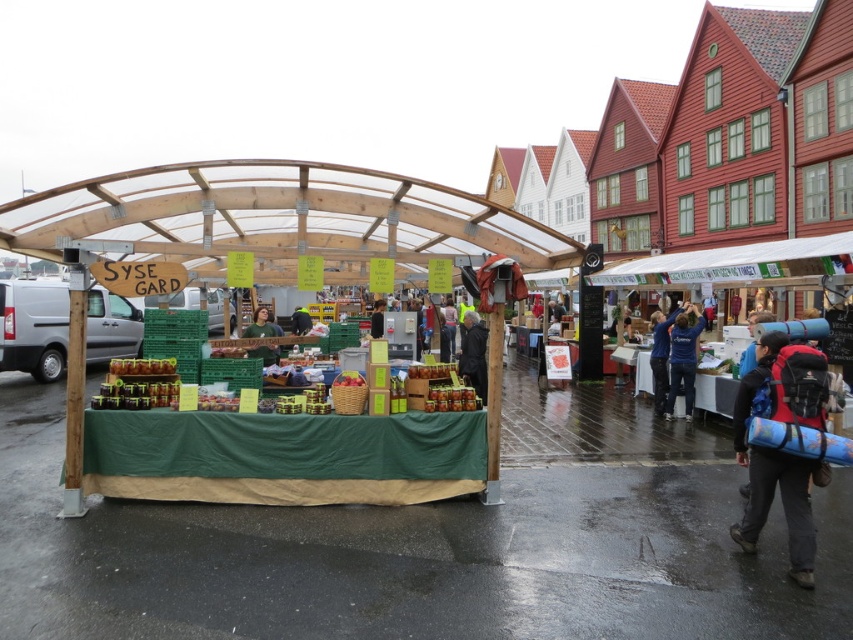
Question: Can you confirm if blue cotton shirt at center is positioned to the right of dark gray jacket at center?

Choices:
 (A) yes
 (B) no

Answer: (A)

Question: Which object is closer to the camera taking this photo?

Choices:
 (A) dark gray jacket at center
 (B) red backpack at right
 (C) blue cotton shirt at center

Answer: (B)

Question: Among these points, which one is farthest from the camera?

Choices:
 (A) (260, 308)
 (B) (802, 556)

Answer: (A)

Question: Can you confirm if red backpack at right is positioned below matte black jacket at center?

Choices:
 (A) yes
 (B) no

Answer: (A)

Question: Which object appears closest to the camera in this image?

Choices:
 (A) matte black jacket at center
 (B) dark gray jacket at center
 (C) red backpack at right

Answer: (C)

Question: Can you confirm if red backpack at right is positioned below dark gray jacket at center?

Choices:
 (A) yes
 (B) no

Answer: (A)